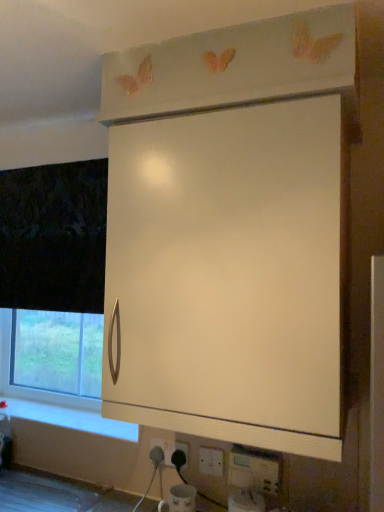
Question: Based on their sizes in the image, would you say white plastic electric outlet at lower center, arranged as the first electric outlet when viewed from the back, is bigger or smaller than white matte cabinet at upper center?

Choices:
 (A) small
 (B) big

Answer: (A)

Question: Looking at their shapes, would you say white plastic electric outlet at lower center, marked as the third electric outlet in a right-to-left arrangement, is wider or thinner than white matte cabinet at upper center?

Choices:
 (A) thin
 (B) wide

Answer: (A)

Question: Estimate the real-world distances between objects in this image. Which object is farther from the white plastic electric outlet at lower center, the second electric outlet when ordered from back to front?

Choices:
 (A) white plastic electric outlet at lower center, marked as the 1th electric outlet in a front-to-back arrangement
 (B) white matte cabinet at upper center
 (C) white plastic electric outlet at lower center, which is the third electric outlet in front-to-back order

Answer: (B)

Question: Which of these objects is positioned closest to the white plastic electric outlet at lower center, marked as the 1th electric outlet in a front-to-back arrangement?

Choices:
 (A) white matte cabinet at upper center
 (B) white plastic electric outlet at lower center, the second electric outlet in the front-to-back sequence
 (C) white plastic electric outlet at lower center, arranged as the first electric outlet when viewed from the back

Answer: (B)